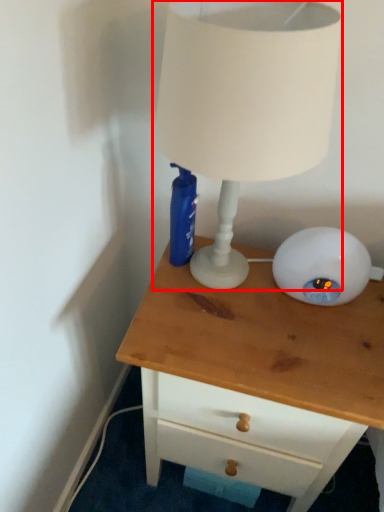
Question: From the image's perspective, considering the relative positions of lamp (annotated by the red box) and chest of drawers in the image provided, where is lamp (annotated by the red box) located with respect to the staircase?

Choices:
 (A) above
 (B) below

Answer: (A)